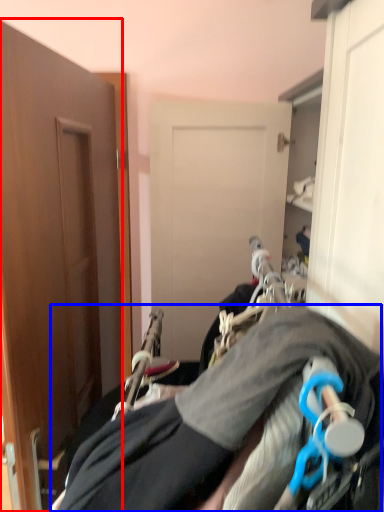
Question: Which point is closer to the camera, door (highlighted by a red box) or couple (highlighted by a blue box)?

Choices:
 (A) door
 (B) couple

Answer: (B)